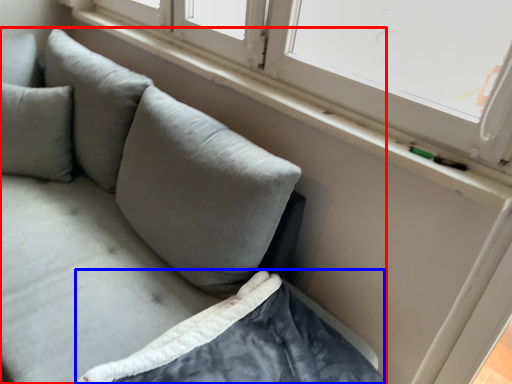
Question: Which of the following is the farthest to the observer, studio couch (highlighted by a red box) or sheet (highlighted by a blue box)?

Choices:
 (A) studio couch
 (B) sheet

Answer: (B)